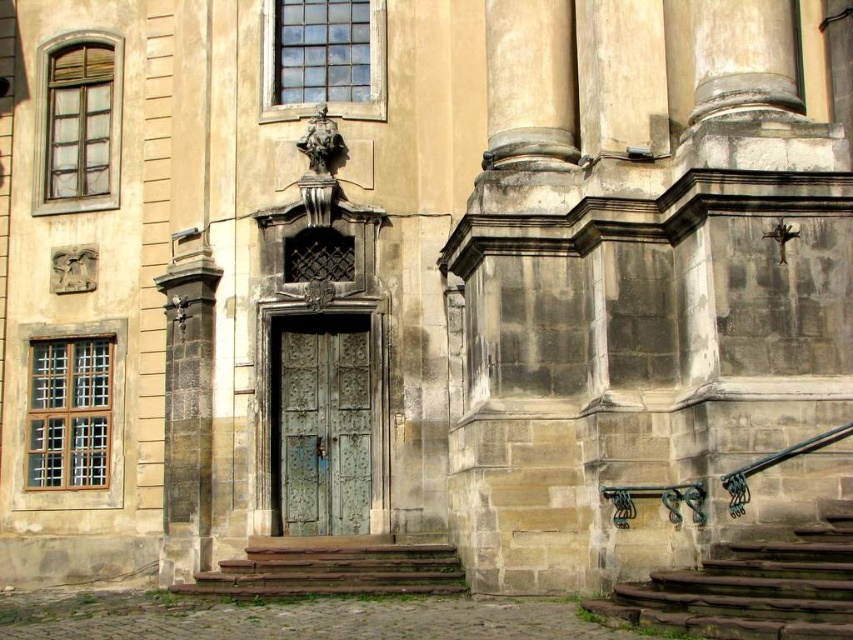
Question: Among these objects, which one is farthest from the camera?

Choices:
 (A) green stone stairs at lower right
 (B) brown stone stairs at lower center
 (C) green patina metal door at center

Answer: (C)

Question: Observing the image, what is the correct spatial positioning of green stone stairs at lower right in reference to brown stone stairs at lower center?

Choices:
 (A) left
 (B) right

Answer: (B)

Question: Is green stone stairs at lower right positioned before brown stone stairs at lower center?

Choices:
 (A) yes
 (B) no

Answer: (A)

Question: Which point appears farthest from the camera in this image?

Choices:
 (A) (361, 568)
 (B) (804, 625)
 (C) (357, 413)

Answer: (C)

Question: Is green stone stairs at lower right to the left of brown stone stairs at lower center from the viewer's perspective?

Choices:
 (A) no
 (B) yes

Answer: (A)

Question: Which is nearer to the green stone stairs at lower right?

Choices:
 (A) brown stone stairs at lower center
 (B) green patina metal door at center

Answer: (A)